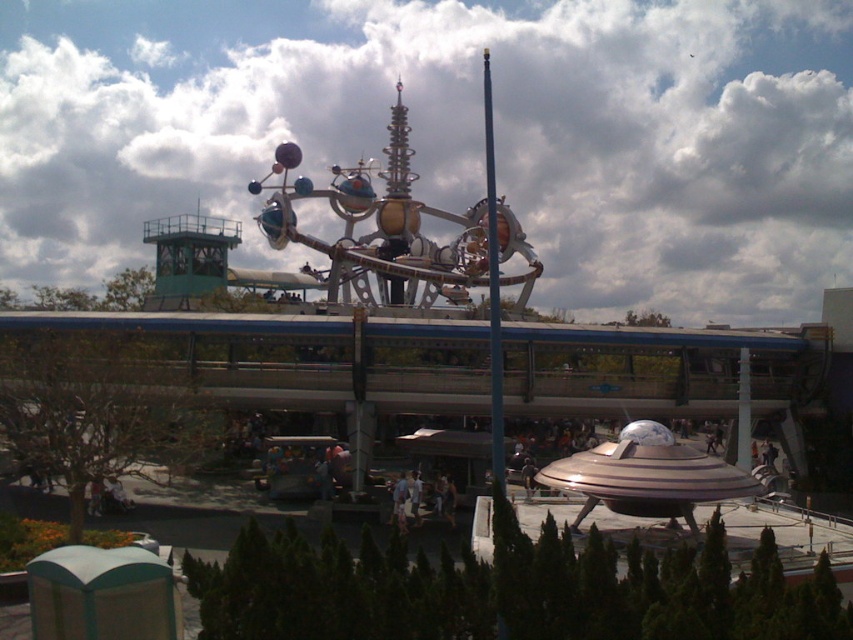
Question: Does metallic silver amusement ride at center appear over metallic pole at center?

Choices:
 (A) no
 (B) yes

Answer: (B)

Question: In this image, where is metallic silver amusement ride at center located relative to metallic pole at center?

Choices:
 (A) above
 (B) below

Answer: (A)

Question: Which point is farther to the camera?

Choices:
 (A) metallic silver amusement ride at center
 (B) metallic pole at center

Answer: (A)

Question: Which point is farther to the camera?

Choices:
 (A) metallic pole at center
 (B) metallic silver amusement ride at center

Answer: (B)

Question: Is metallic silver amusement ride at center below metallic pole at center?

Choices:
 (A) no
 (B) yes

Answer: (A)